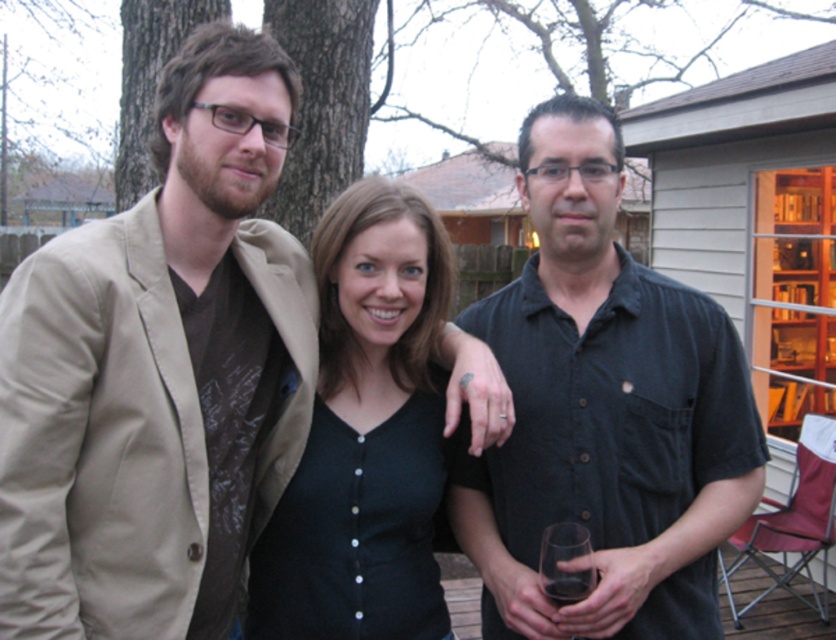
Question: Can you confirm if transparent glass at right is positioned to the right of transparent glass at center?

Choices:
 (A) yes
 (B) no

Answer: (B)

Question: Is transparent glass at right positioned in front of transparent glass at center?

Choices:
 (A) no
 (B) yes

Answer: (B)

Question: Which point is farther from the camera taking this photo?

Choices:
 (A) (696, 433)
 (B) (582, 573)
 (C) (283, 598)
 (D) (33, 625)

Answer: (C)

Question: Which object appears closest to the camera in this image?

Choices:
 (A) transparent glass at right
 (B) matte beige blazer at left
 (C) dark gray shirt at center
 (D) transparent glass at center

Answer: (B)

Question: Which point is closer to the camera?

Choices:
 (A) (380, 579)
 (B) (561, 598)

Answer: (B)

Question: Does matte beige blazer at left have a larger size compared to black matte shirt at center?

Choices:
 (A) no
 (B) yes

Answer: (B)